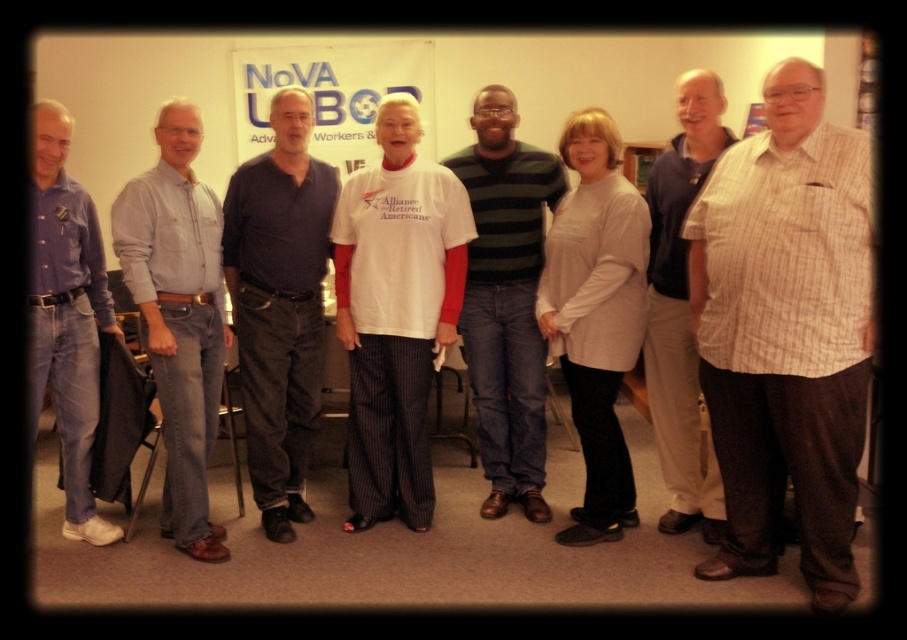
You are taking a photo of the group and want to focus on the point at the center of the image. Which of the two points, point (303,323) or point (667,202), is closer to the camera and should be in focus?

Point (303,323) is further to the camera than point (667,202), so the point that is closer to the camera and should be in focus is point (667,202).

From the picture: You are a photographer setting up for a group photo in a room with a banner that says NoVA LABOR. You notice a person wearing a dark blue shirt at center. Where should you position your camera to ensure this person is centered in the frame?

To center the person in the dark blue shirt at center, position the camera at point 0.477 on the horizontal axis and 0.309 on the vertical axis, as this corresponds to their location in the scene.